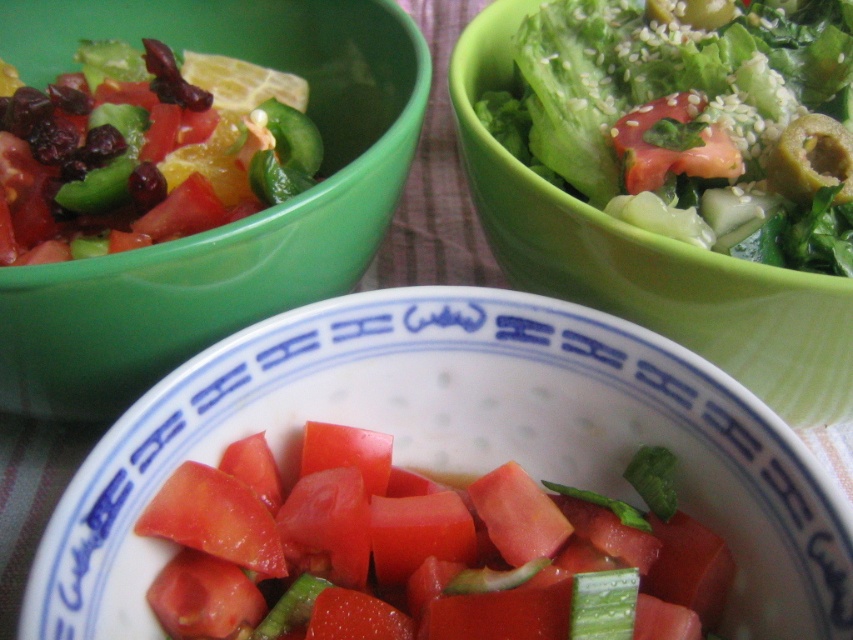
You are a food critic standing at the table. You want to taste the shiny green salad at upper left. Can you reach it without moving your hand past the green plastic bowl at upper left?

Result: The green plastic bowl at upper left is closer to the viewer than the shiny green salad at upper left, so you can reach the shiny green salad at upper left without moving your hand past the green plastic bowl at upper left.

From the picture: You are a food critic standing 20 inches away from the table. You want to reach the green plastic bowl at upper left to taste its salad. Can you comfortably reach it without moving your position?

The green plastic bowl at upper left is 21.15 inches away from viewer, so you cannot comfortably reach it from your current position of 20 inches away without moving.

You are a food critic inspecting the salads and bowls in the image. Which object is located below the other between the green plastic bowl at upper left and the shiny green salad at upper left?

The green plastic bowl at upper left is positioned under the shiny green salad at upper left, so the bowl is below the salad.